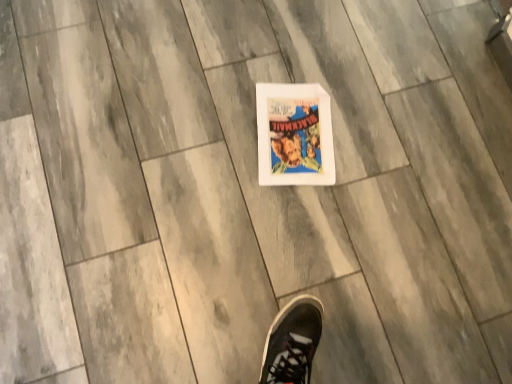
I want to click on vacant space behind matte paper comic book at center, so click(x=327, y=46).